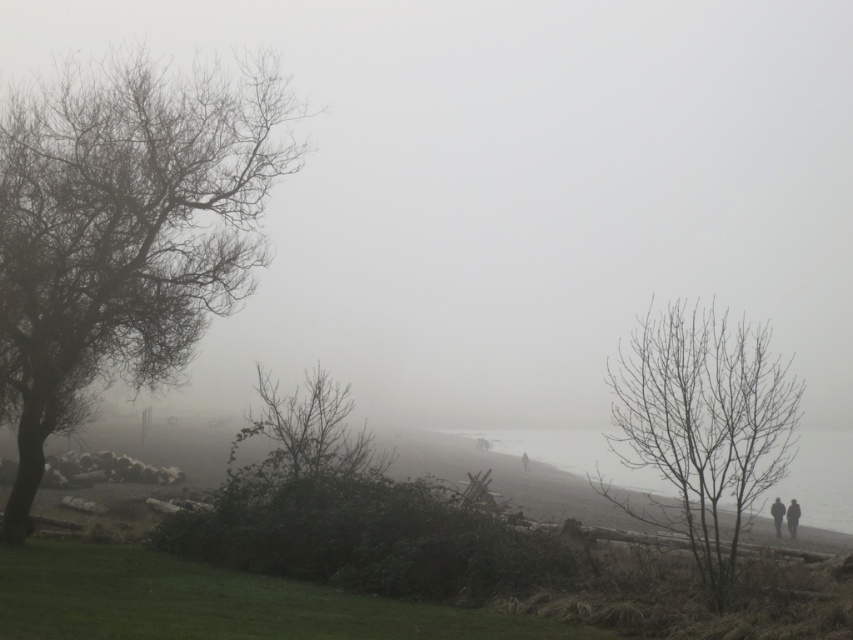
You are standing on the beach and want to take a photo of the gray foggy water at center and the bare branches at center. Which object will appear larger in your photo?

The gray foggy water at center will appear larger in the photo because it is closer to the viewer than the bare branches at center.

You are a hiker trying to navigate through the foggy atmosphere at center and the bare branches at right. Which object will you encounter first as you move forward?

The bare branches at right will be encountered first because they are closer to the observer than the foggy atmosphere at center, which is further away.